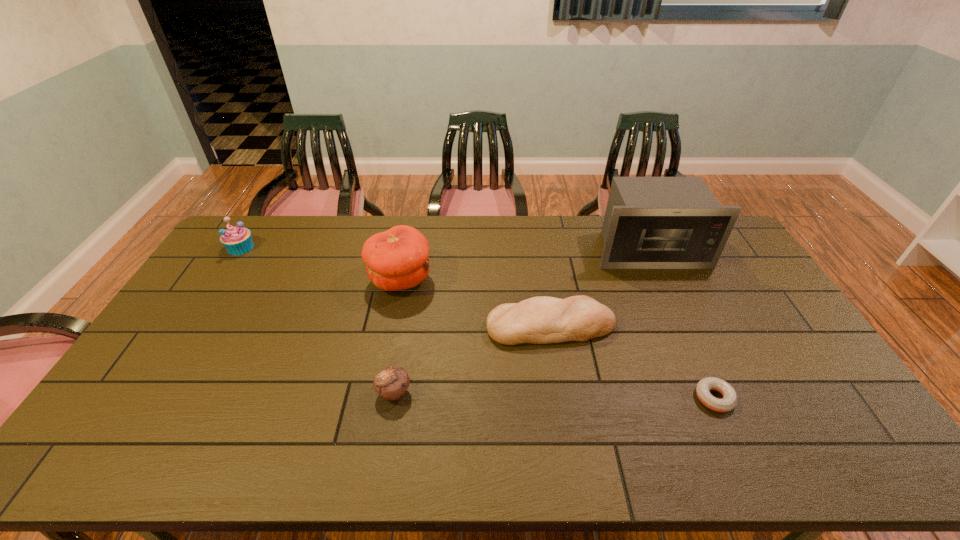
This screenshot has height=540, width=960. What are the coordinates of `the tallest object` in the screenshot? It's located at (650, 222).

Find the location of a particular element. the fifth shortest object is located at coordinates [396, 259].

Image resolution: width=960 pixels, height=540 pixels. What are the coordinates of `the farther muffin` in the screenshot? It's located at click(x=237, y=240).

This screenshot has height=540, width=960. Find the location of `the taller muffin`. the taller muffin is located at coordinates coord(237,240).

Identify the location of bread. The height and width of the screenshot is (540, 960). (538, 320).

Where is `the fourth farthest object`? Image resolution: width=960 pixels, height=540 pixels. the fourth farthest object is located at coordinates (538, 320).

What are the coordinates of `the shorter muffin` in the screenshot? It's located at (391, 383).

The image size is (960, 540). I want to click on the nearer muffin, so click(391, 383).

In order to click on doughnut in this screenshot , I will do `click(703, 387)`.

I want to click on free region located 0.220m on the front-facing side of the tallest object, so click(x=679, y=316).